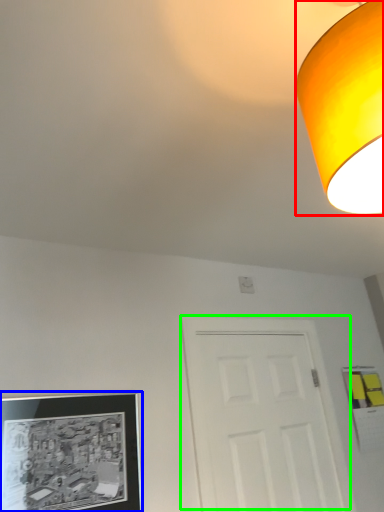
Question: Considering the real-world distances, which object is closest to lamp (highlighted by a red box)? picture frame (highlighted by a blue box) or door (highlighted by a green box).

Choices:
 (A) picture frame
 (B) door

Answer: (A)